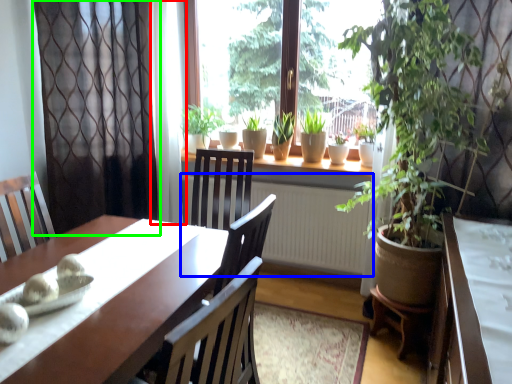
Question: Considering the real-world distances, which object is closest to curtain (highlighted by a red box)? radiator (highlighted by a blue box) or curtain (highlighted by a green box).

Choices:
 (A) radiator
 (B) curtain

Answer: (B)